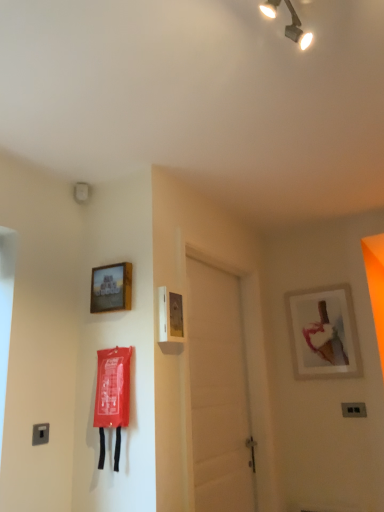
Question: From the image's perspective, would you say matte white picture frame at upper right, arranged as the 2th picture frame when viewed from the left, is positioned over black plastic light switch at lower right, which ranks as the 2th light switch in left-to-right order?

Choices:
 (A) no
 (B) yes

Answer: (B)

Question: From a real-world perspective, is matte white picture frame at upper right, the 2th picture frame when ordered from top to bottom, on black plastic light switch at lower right, marked as the 2th light switch in a top-to-bottom arrangement?

Choices:
 (A) no
 (B) yes

Answer: (B)

Question: Can you confirm if matte white picture frame at upper right, which appears as the 1th picture frame when viewed from the back, is taller than black plastic light switch at lower right, marked as the 2th light switch in a top-to-bottom arrangement?

Choices:
 (A) no
 (B) yes

Answer: (B)

Question: From the image's perspective, is matte white picture frame at upper right, arranged as the 2th picture frame when viewed from the left, located beneath black plastic light switch at lower right, marked as the 2th light switch in a top-to-bottom arrangement?

Choices:
 (A) yes
 (B) no

Answer: (B)

Question: Considering the relative sizes of matte white picture frame at upper right, the 2th picture frame when ordered from top to bottom, and black plastic light switch at lower right, which appears as the 2th light switch when viewed from the front, in the image provided, is matte white picture frame at upper right, the 2th picture frame when ordered from top to bottom, smaller than black plastic light switch at lower right, which appears as the 2th light switch when viewed from the front,?

Choices:
 (A) yes
 (B) no

Answer: (B)

Question: In terms of width, does black plastic light switch at lower right, marked as the 1th light switch in a bottom-to-top arrangement, look wider or thinner when compared to satin silver switch at lower left, marked as the first light switch in a top-to-bottom arrangement?

Choices:
 (A) wide
 (B) thin

Answer: (A)

Question: Based on their sizes in the image, would you say black plastic light switch at lower right, which appears as the 2th light switch when viewed from the front, is bigger or smaller than satin silver switch at lower left, placed as the 1th light switch when sorted from left to right?

Choices:
 (A) small
 (B) big

Answer: (B)

Question: Considering the positions of point (342, 409) and point (44, 426), is point (342, 409) closer or farther from the camera than point (44, 426)?

Choices:
 (A) farther
 (B) closer

Answer: (A)

Question: In terms of height, does black plastic light switch at lower right, which ranks as the 2th light switch in left-to-right order, look taller or shorter compared to satin silver switch at lower left, placed as the 1th light switch when sorted from left to right?

Choices:
 (A) tall
 (B) short

Answer: (B)

Question: Is point (246, 382) positioned closer to the camera than point (297, 40)?

Choices:
 (A) farther
 (B) closer

Answer: (A)

Question: Which is correct: white matte door at center is inside metallic track lighting at upper center, or outside of it?

Choices:
 (A) inside
 (B) outside

Answer: (B)

Question: From the image's perspective, relative to metallic track lighting at upper center, is white matte door at center above or below?

Choices:
 (A) below
 (B) above

Answer: (A)

Question: In the image, is white matte door at center positioned in front of or behind metallic track lighting at upper center?

Choices:
 (A) behind
 (B) front

Answer: (A)

Question: Is white matte door at center taller or shorter than satin silver switch at lower left, marked as the first light switch in a top-to-bottom arrangement?

Choices:
 (A) short
 (B) tall

Answer: (B)

Question: In the image, is white matte door at center on the left side or the right side of satin silver switch at lower left, marked as the first light switch in a top-to-bottom arrangement?

Choices:
 (A) right
 (B) left

Answer: (A)